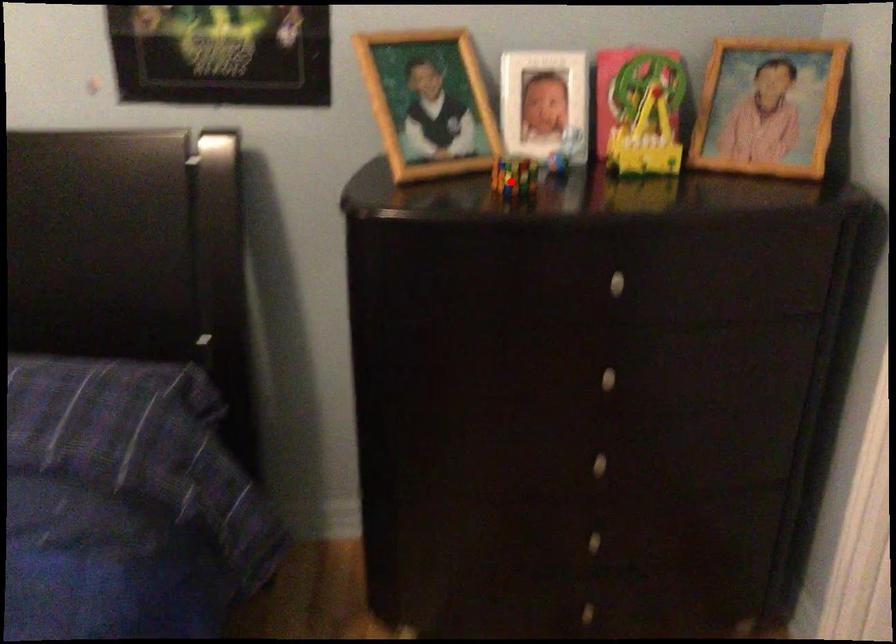
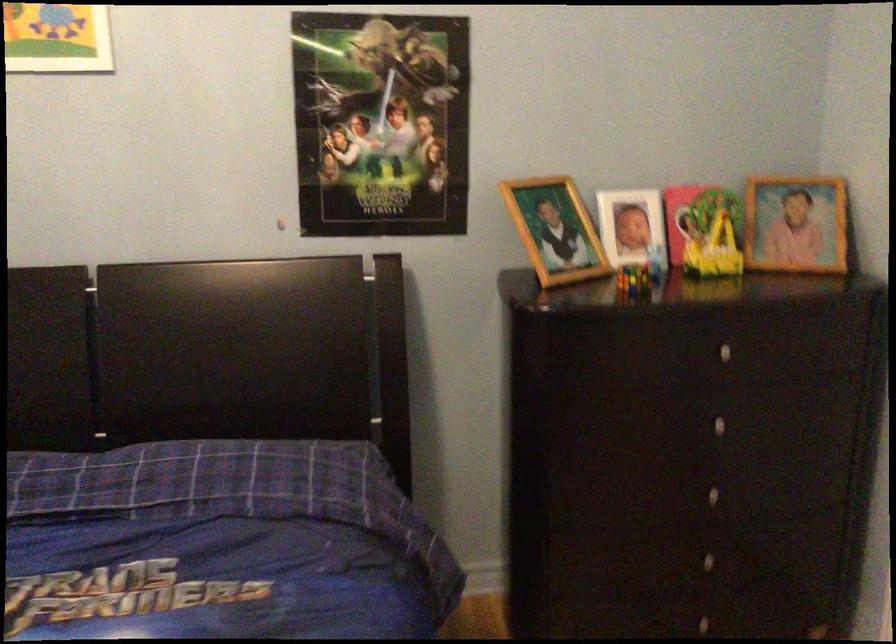
Find the pixel in the second image that matches the highlighted location in the first image.

(634, 279)